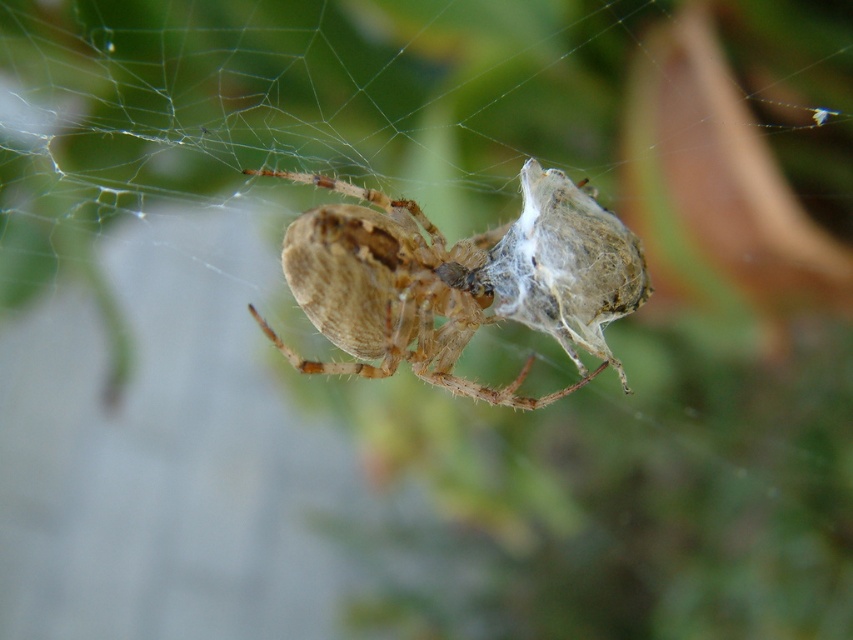
Question: Observing the image, what is the correct spatial positioning of translucent silk web at center in reference to brown fuzzy spider at center?

Choices:
 (A) above
 (B) below

Answer: (A)

Question: Which object is farther from the camera taking this photo?

Choices:
 (A) brown fuzzy spider at center
 (B) translucent silk web at center

Answer: (B)

Question: In this image, where is translucent silk web at center located relative to brown fuzzy spider at center?

Choices:
 (A) below
 (B) above

Answer: (B)

Question: From the image, what is the correct spatial relationship of translucent silk web at center in relation to brown fuzzy spider at center?

Choices:
 (A) below
 (B) above

Answer: (B)